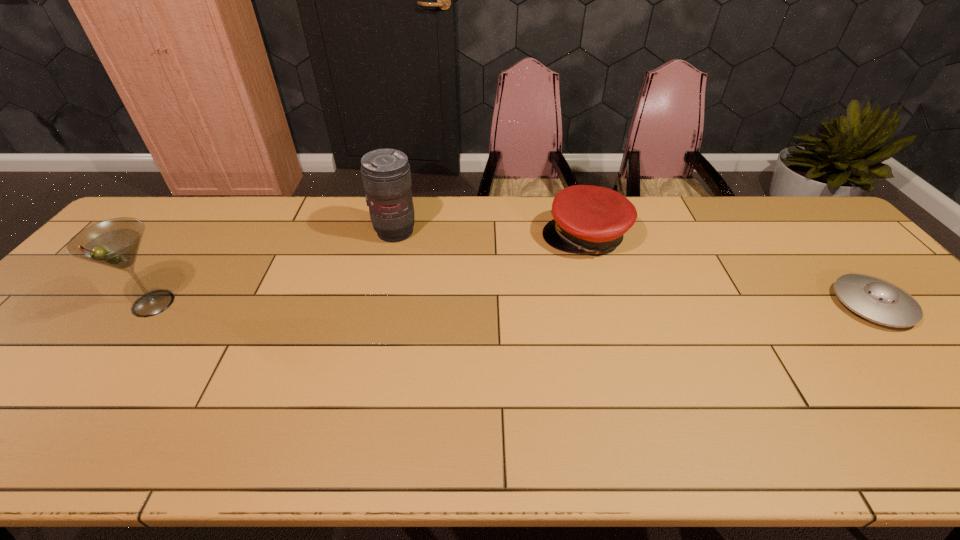
I want to click on free space located 0.140m at the front of the second object from right to left where the visor is located, so click(525, 276).

The width and height of the screenshot is (960, 540). Identify the location of vacant space located on the side of the telephoto lens where the control switches are located. (442, 261).

What are the coordinates of `vacant space situated 0.070m on the side of the telephoto lens where the control switches are located` in the screenshot? It's located at (425, 251).

The width and height of the screenshot is (960, 540). I want to click on vacant space situated on the side of the telephoto lens where the control switches are located, so click(x=429, y=254).

This screenshot has width=960, height=540. I want to click on cap at the far edge, so click(592, 219).

Locate an element on the screen. telephoto lens at the far edge is located at coordinates (386, 175).

This screenshot has width=960, height=540. Find the location of `object that is at the right edge`. object that is at the right edge is located at coordinates (875, 299).

This screenshot has height=540, width=960. In the image, there is a desktop. In order to click on vacant space at the far edge in this screenshot , I will do `click(274, 214)`.

Image resolution: width=960 pixels, height=540 pixels. In order to click on vacant space at the near edge of the desktop in this screenshot , I will do `click(67, 407)`.

At what (x,y) coordinates should I click in order to perform the action: click on vacant area that lies between the second shortest object and the leftmost object. Please return your answer as a coordinate pair (x, y). The width and height of the screenshot is (960, 540). Looking at the image, I should click on (370, 271).